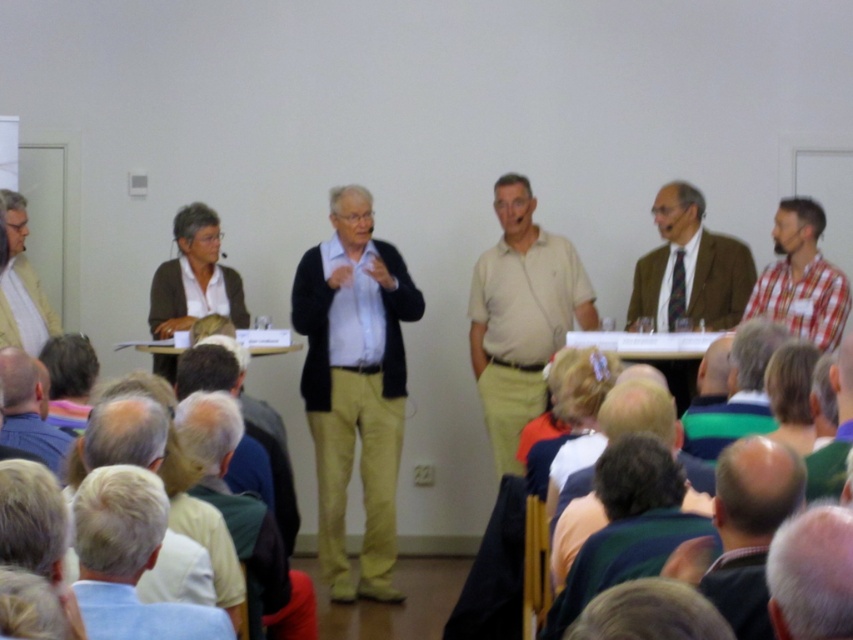
Does white matte hair at lower left have a lesser height compared to light beige sweater at left?

Indeed, white matte hair at lower left has a lesser height compared to light beige sweater at left.

In the scene shown: Can you confirm if white matte hair at lower left is smaller than light beige sweater at left?

Yes, white matte hair at lower left is smaller than light beige sweater at left.

Where is `white matte hair at lower left`? white matte hair at lower left is located at coordinates (131, 557).

Between point (770, 605) and point (801, 323), which one is positioned behind?

Positioned behind is point (801, 323).

Is fluffy pink fur at lower right smaller than checkered fabric shirt at right?

Correct, fluffy pink fur at lower right occupies less space than checkered fabric shirt at right.

Is point (851, 634) in front of point (825, 289)?

Yes.

Locate an element on the screen. This screenshot has width=853, height=640. fluffy pink fur at lower right is located at coordinates (811, 573).

Identify the location of matte brown suit at center. The image size is (853, 640). (689, 266).

Who is positioned more to the right, matte brown suit at center or fluffy pink fur at lower right?

Positioned to the right is matte brown suit at center.

Find the location of a particular element. This screenshot has width=853, height=640. matte brown suit at center is located at coordinates (689, 266).